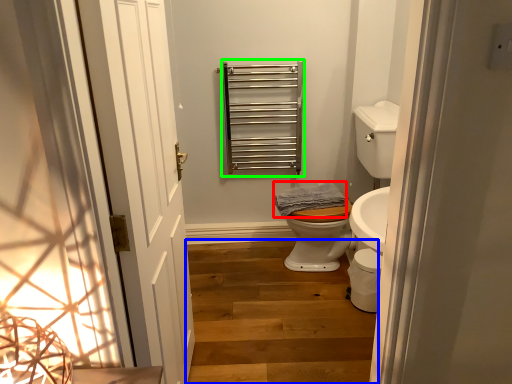
Question: Which object is the closest to the material (highlighted by a red box)? Choose among these: stairs (highlighted by a blue box) or balustrade (highlighted by a green box).

Choices:
 (A) stairs
 (B) balustrade

Answer: (B)